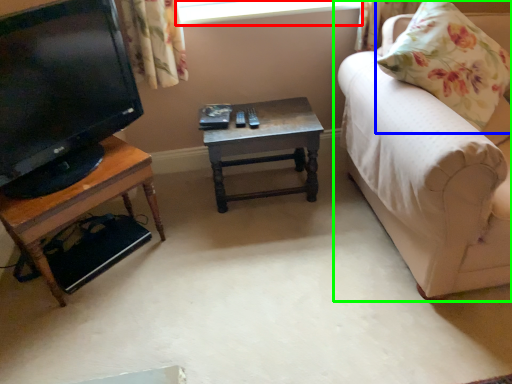
Question: Which object is the farthest from window screen (highlighted by a red box)? Choose among these: pillow (highlighted by a blue box) or studio couch (highlighted by a green box).

Choices:
 (A) pillow
 (B) studio couch

Answer: (B)